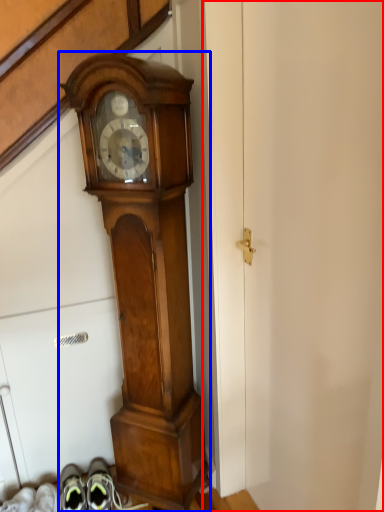
Question: Which object appears farthest to the camera in this image, door (highlighted by a red box) or wall clock (highlighted by a blue box)?

Choices:
 (A) door
 (B) wall clock

Answer: (B)